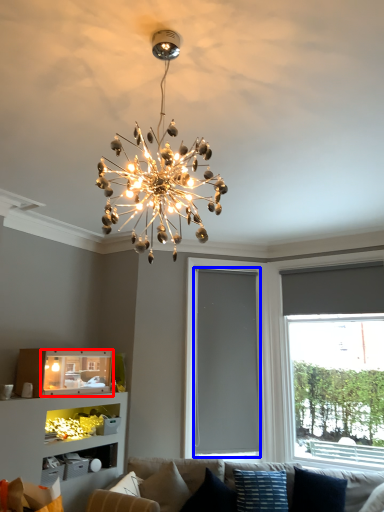
Question: Which point is further to the camera, shelf (highlighted by a red box) or window screen (highlighted by a blue box)?

Choices:
 (A) shelf
 (B) window screen

Answer: (B)